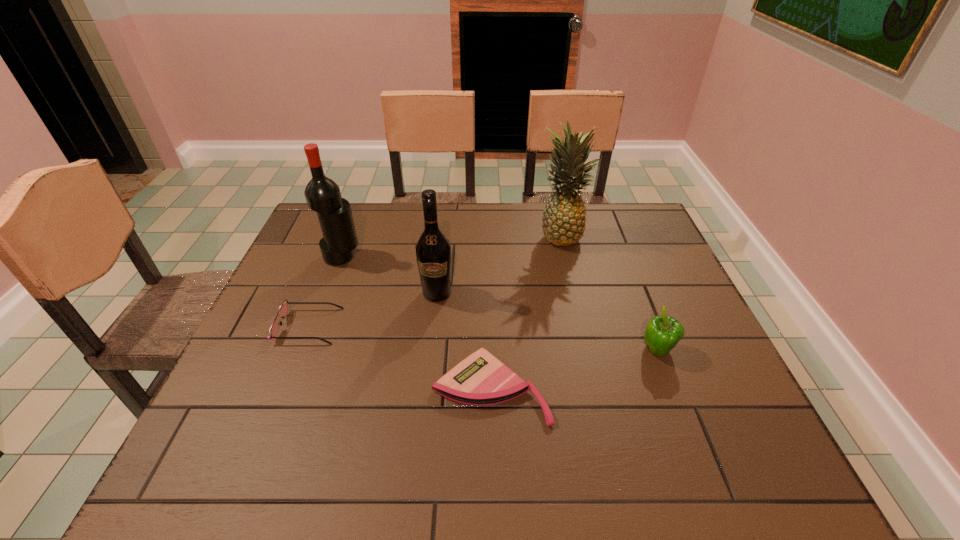
Where is `the second object from right to left`? the second object from right to left is located at coordinates (563, 222).

Locate an element on the screen. Image resolution: width=960 pixels, height=540 pixels. the left wine bottle is located at coordinates (322, 194).

You are a GUI agent. You are given a task and a screenshot of the screen. Output one action in this format:
    pyautogui.click(x=<x>, y=<y>)
    Task: Click on the nearer wine bottle
    Image resolution: width=960 pixels, height=540 pixels.
    Given the screenshot: What is the action you would take?
    pyautogui.click(x=433, y=250)

Locate an element on the screen. The width and height of the screenshot is (960, 540). the fourth nearest object is located at coordinates (433, 250).

At what (x,y) coordinates should I click in order to perform the action: click on the third shortest object. Please return your answer as a coordinate pair (x, y). Looking at the image, I should click on (663, 332).

At what (x,y) coordinates should I click in order to perform the action: click on the rightmost object. Please return your answer as a coordinate pair (x, y). This screenshot has height=540, width=960. Looking at the image, I should click on (663, 332).

Find the location of a particular element. the fifth tallest object is located at coordinates (283, 310).

Where is `wristlet`? The height and width of the screenshot is (540, 960). wristlet is located at coordinates (480, 379).

At what (x,y) coordinates should I click in order to perform the action: click on vacant space situated on the left of the pineapple. Please return your answer as a coordinate pair (x, y). The image size is (960, 540). Looking at the image, I should click on (420, 236).

You are a GUI agent. You are given a task and a screenshot of the screen. Output one action in this format:
    pyautogui.click(x=<x>, y=<y>)
    Task: Click on the vacant space located on the right of the left wine bottle
    Image resolution: width=960 pixels, height=540 pixels.
    Given the screenshot: What is the action you would take?
    pyautogui.click(x=411, y=257)